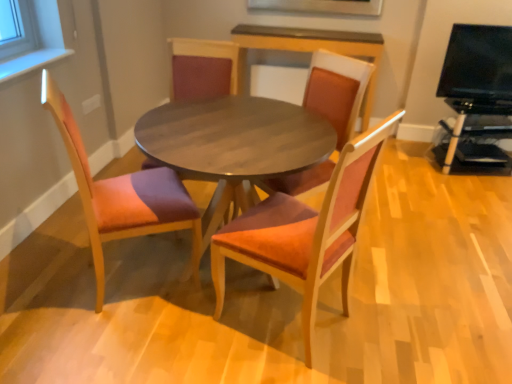
What are the coordinates of `free space in front of orange fabric chair at left, the first chair from the left` in the screenshot? It's located at (109, 341).